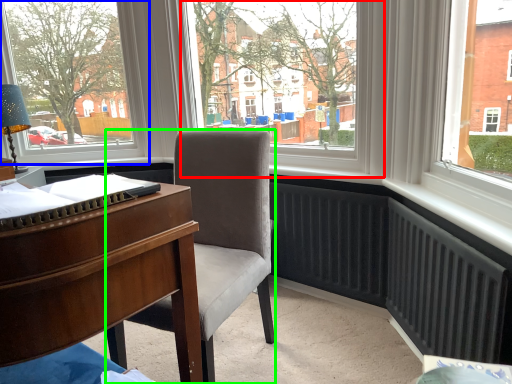
Question: Which object is positioned closest to window screen (highlighted by a red box)? Select from window (highlighted by a blue box) and chair (highlighted by a green box).

Choices:
 (A) window
 (B) chair

Answer: (B)